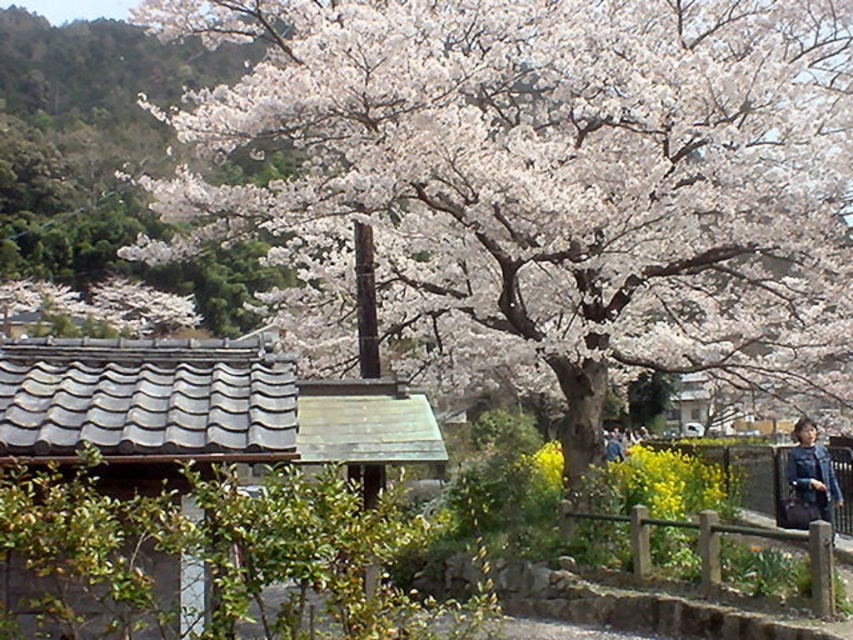
Question: Is white blossoms at center positioned behind blue fabric jacket at lower right?

Choices:
 (A) no
 (B) yes

Answer: (A)

Question: Which point is closer to the camera?

Choices:
 (A) blue fabric jacket at lower right
 (B) white blossoms at center

Answer: (B)

Question: Which point is farther to the camera?

Choices:
 (A) white blossoms at center
 (B) blue fabric jacket at lower right

Answer: (B)

Question: Which object appears closest to the camera in this image?

Choices:
 (A) blue fabric jacket at lower right
 (B) white blossoms at center

Answer: (B)

Question: Is white blossoms at center below blue fabric jacket at lower right?

Choices:
 (A) yes
 (B) no

Answer: (B)

Question: Does white blossoms at center appear on the right side of blue fabric jacket at lower right?

Choices:
 (A) yes
 (B) no

Answer: (B)